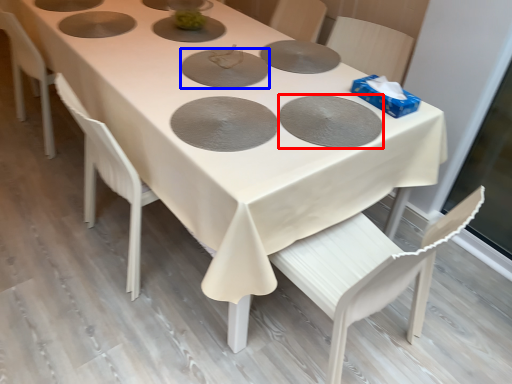
Question: Among these objects, which one is nearest to the camera, pizza pan (highlighted by a red box) or pizza pan (highlighted by a blue box)?

Choices:
 (A) pizza pan
 (B) pizza pan

Answer: (A)